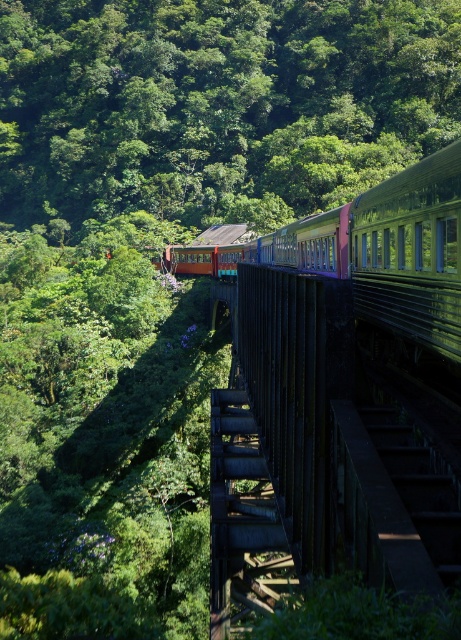
Question: Does green leafy tree at upper center come in front of dark brown wooden bridge at center?

Choices:
 (A) no
 (B) yes

Answer: (A)

Question: Which of the following is the closest to the observer?

Choices:
 (A) green leafy tree at upper center
 (B) dark brown wooden bridge at center

Answer: (B)

Question: Does green leafy tree at upper center appear over dark brown wooden bridge at center?

Choices:
 (A) no
 (B) yes

Answer: (B)

Question: Considering the relative positions of green leafy tree at upper center and dark brown wooden bridge at center in the image provided, where is green leafy tree at upper center located with respect to dark brown wooden bridge at center?

Choices:
 (A) right
 (B) left

Answer: (B)

Question: Which point is closer to the camera?

Choices:
 (A) green leafy tree at upper center
 (B) dark brown wooden bridge at center

Answer: (B)